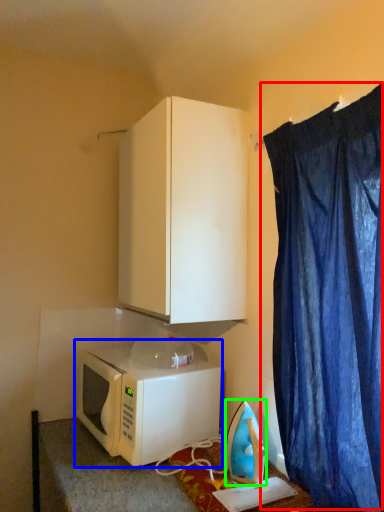
Question: Estimate the real-world distances between objects in this image. Which object is closer to curtain (highlighted by a red box), microwave oven (highlighted by a blue box) or appliance (highlighted by a green box)?

Choices:
 (A) microwave oven
 (B) appliance

Answer: (B)